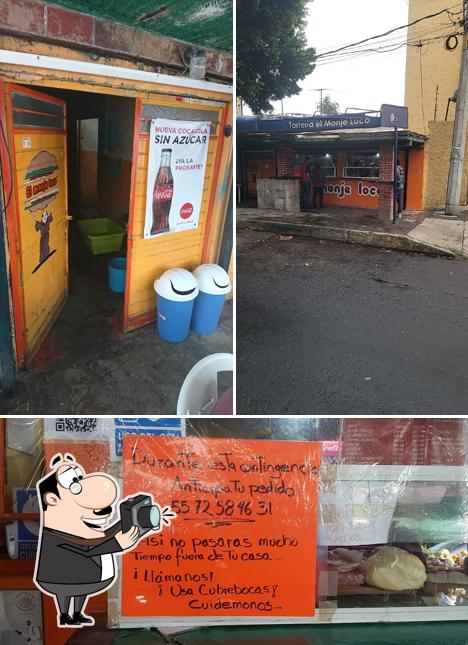
Locate an element on the screen. The height and width of the screenshot is (645, 468). wash bin is located at coordinates coord(100,231).